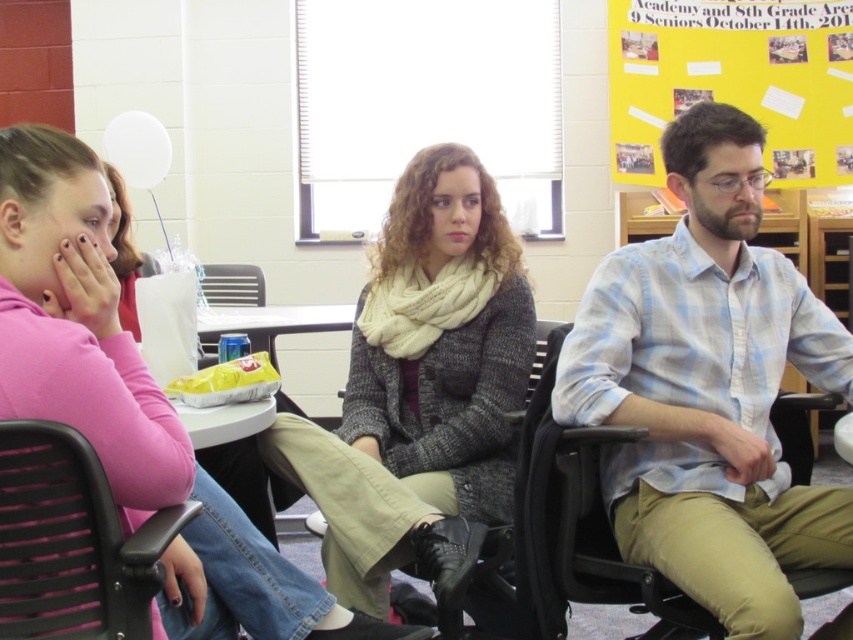
Question: Is light blue plaid shirt at center to the left of yellow paper at upper right from the viewer's perspective?

Choices:
 (A) no
 (B) yes

Answer: (B)

Question: Which object appears closest to the camera in this image?

Choices:
 (A) yellow paper at upper right
 (B) light blue plaid shirt at center

Answer: (B)

Question: Does pink fabric shirt at left appear on the right side of white plastic table at center?

Choices:
 (A) yes
 (B) no

Answer: (A)

Question: Is yellow paper at upper right smaller than white plastic table at center?

Choices:
 (A) no
 (B) yes

Answer: (A)

Question: Which point is farther from the camera taking this photo?

Choices:
 (A) (22, 472)
 (B) (293, 310)
 (C) (711, 49)
 (D) (612, 336)

Answer: (C)

Question: Which is farther from the black plastic swivel chair at lower left?

Choices:
 (A) knitted cream scarf at center
 (B) white plastic table at center
 (C) light blue plaid shirt at center

Answer: (B)